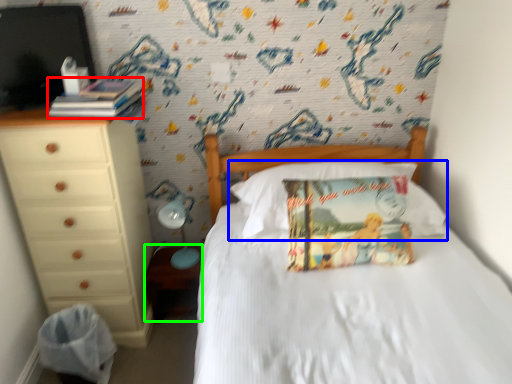
Question: Which object is the closest to the book (highlighted by a red box)? Choose among these: pillow (highlighted by a blue box) or nightstand (highlighted by a green box).

Choices:
 (A) pillow
 (B) nightstand

Answer: (A)